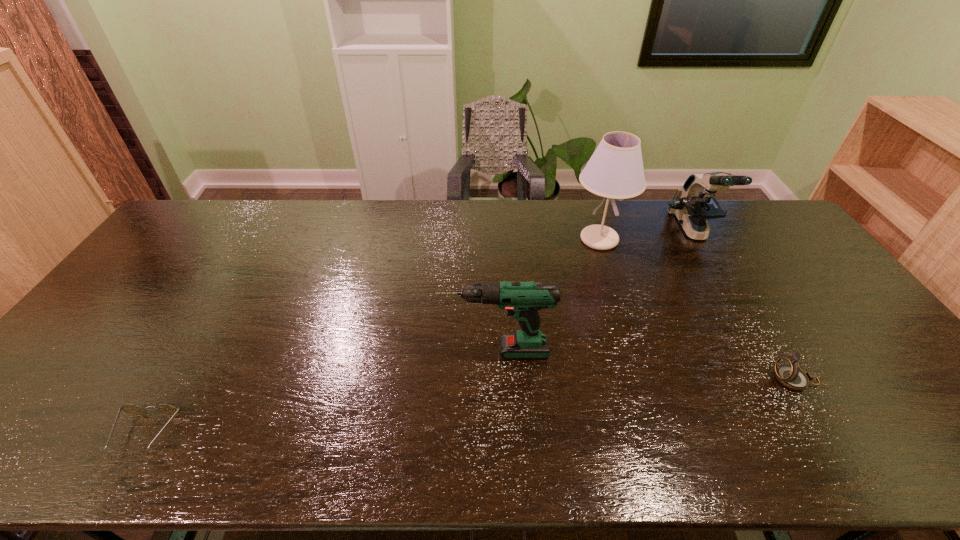
Identify the location of free space at the far edge of the desktop. (283, 234).

Image resolution: width=960 pixels, height=540 pixels. I want to click on free space at the near edge of the desktop, so click(x=289, y=464).

Where is `vacant space at the left edge of the desktop`? The image size is (960, 540). vacant space at the left edge of the desktop is located at coordinates (137, 287).

The height and width of the screenshot is (540, 960). What are the coordinates of `vacant position at the right edge of the desktop` in the screenshot? It's located at (880, 364).

This screenshot has height=540, width=960. In order to click on vacant space at the far right corner of the desktop in this screenshot , I will do `click(745, 221)`.

At what (x,y) coordinates should I click in order to perform the action: click on vacant point located between the fourth tallest object and the third farthest object. Please return your answer as a coordinate pair (x, y). The image size is (960, 540). Looking at the image, I should click on (645, 366).

Identify the location of free space that is in between the microscope and the lampshade. (646, 235).

At what (x,y) coordinates should I click in order to perform the action: click on vacant area between the third farthest object and the shortest object. Please return your answer as a coordinate pair (x, y). This screenshot has width=960, height=540. Looking at the image, I should click on (321, 393).

This screenshot has width=960, height=540. What are the coordinates of `free space between the second object from left to right and the microscope` in the screenshot? It's located at (594, 291).

Identify the location of empty space between the fourth farthest object and the lampshade. (697, 309).